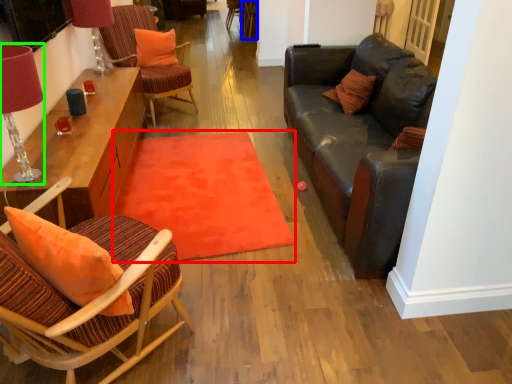
Question: Based on their relative distances, which object is farther from mat (highlighted by a red box)? Choose from armchair (highlighted by a blue box) and table lamp (highlighted by a green box).

Choices:
 (A) armchair
 (B) table lamp

Answer: (A)